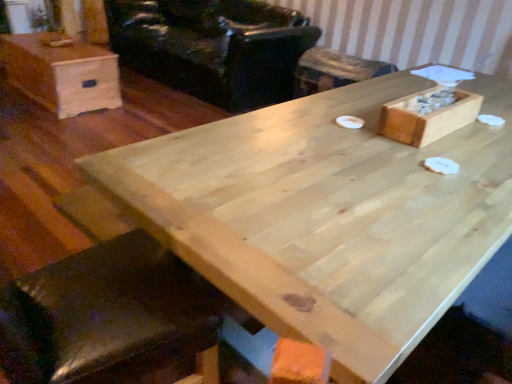
Question: Do you think black leather armchair at upper center is within natural wood table at center, or outside of it?

Choices:
 (A) outside
 (B) inside

Answer: (A)

Question: Is black leather armchair at upper center bigger or smaller than natural wood table at center?

Choices:
 (A) small
 (B) big

Answer: (B)

Question: Which object is positioned closest to the wooden bar stool at center?

Choices:
 (A) light brown wood box at upper left
 (B) natural wood table at center
 (C) wooden box at upper right
 (D) black leather armchair at upper center

Answer: (D)

Question: Estimate the real-world distances between objects in this image. Which object is farther from the wooden bar stool at center?

Choices:
 (A) wooden box at upper right
 (B) black leather armchair at upper center
 (C) natural wood table at center
 (D) light brown wood box at upper left

Answer: (D)